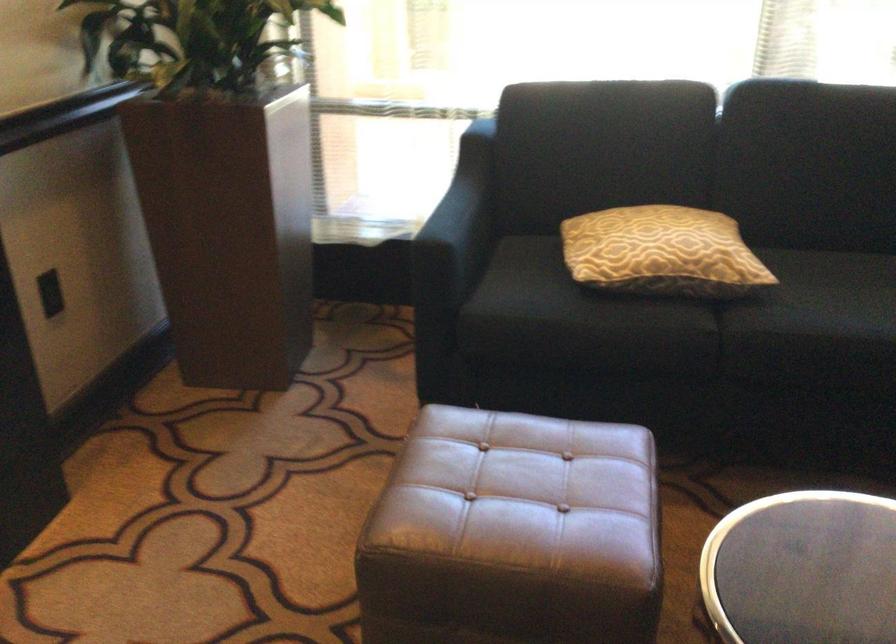
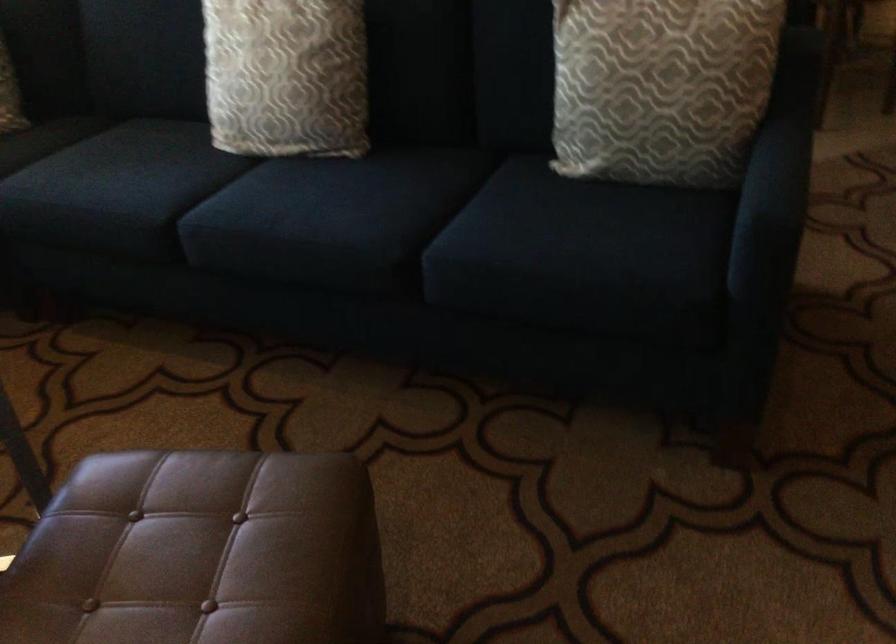
How did the camera likely rotate?

The camera's rotation is toward right-down.